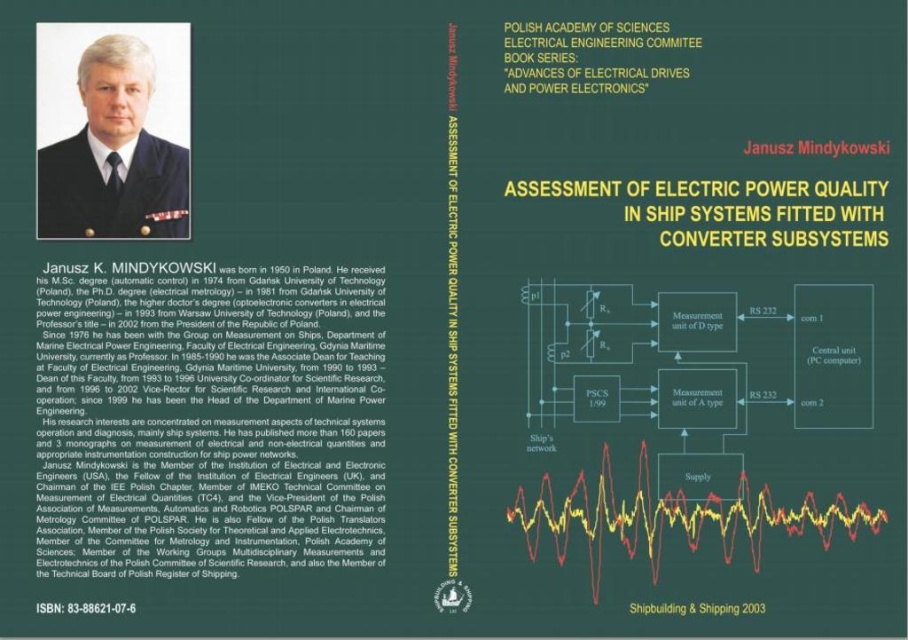
You are a graphic designer reviewing the book cover and need to adjust the text placement. There are two points marked on the left side of the cover at coordinates point (123, 52) and point (658, 77). Which point is nearer to the viewer?

Point (123, 52) is closer to the camera than point (658, 77), so the first point is nearer to the viewer.

You are a reader looking at the book cover and notice the matte black uniform at upper left and the green paper at upper center. Which object appears closer to you?

The matte black uniform at upper left appears closer to you because it is further to the viewer than the green paper at upper center.